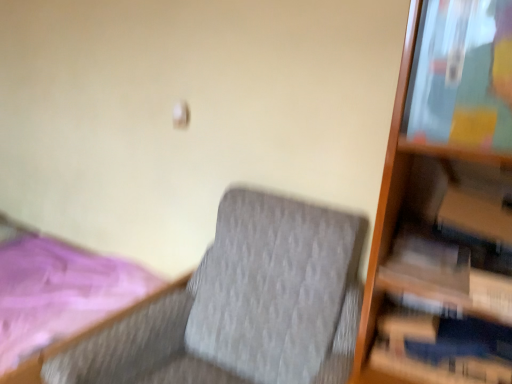
Where is `white matte paperback book at right`? Image resolution: width=512 pixels, height=384 pixels. white matte paperback book at right is located at coordinates (426, 267).

Locate an element on the screen. pink fabric bed at lower left is located at coordinates (52, 353).

Which is more distant, [119,342] or [414,262]?

The point [119,342] is farther.

Looking at this image, considering the sizes of objects textured gray fabric rocking chair at center and white matte paperback book at right in the image provided, who is thinner, textured gray fabric rocking chair at center or white matte paperback book at right?

white matte paperback book at right is thinner.

Is textured gray fabric rocking chair at center completely or partially outside of white matte paperback book at right?

Yes.

Is textured gray fabric rocking chair at center looking in the opposite direction of pink fabric bed at lower left?

No, textured gray fabric rocking chair at center is not facing away from pink fabric bed at lower left.

I want to click on rocking chair located in front of the pink fabric bed at lower left, so click(x=243, y=306).

How different are the orientations of textured gray fabric rocking chair at center and pink fabric bed at lower left in degrees?

89.9 degrees.

Is textured gray fabric rocking chair at center at the left side of pink fabric bed at lower left?

Incorrect, textured gray fabric rocking chair at center is not on the left side of pink fabric bed at lower left.

Is there a large distance between white matte paperback book at right and pink fabric bed at lower left?

Yes, white matte paperback book at right and pink fabric bed at lower left are located far from each other.

Is the position of white matte paperback book at right more distant than that of pink fabric bed at lower left?

No, it is not.

From the image's perspective, who appears lower, white matte paperback book at right or pink fabric bed at lower left?

pink fabric bed at lower left appears lower in the image.

How different are the orientations of white matte paperback book at right and pink fabric bed at lower left in degrees?

white matte paperback book at right and pink fabric bed at lower left are facing 82.9 degrees away from each other.

Are pink fabric bed at lower left and textured gray fabric rocking chair at center located far from each other?

Yes, pink fabric bed at lower left is far from textured gray fabric rocking chair at center.

Is textured gray fabric rocking chair at center surrounded by pink fabric bed at lower left?

No.

Is point (4, 234) positioned before point (317, 337)?

No, (4, 234) is further to viewer.

Is pink fabric bed at lower left facing towards textured gray fabric rocking chair at center?

Yes.

Is pink fabric bed at lower left further to the viewer compared to white matte paperback book at right?

Yes.

Is white matte paperback book at right located within pink fabric bed at lower left?

Actually, white matte paperback book at right is outside pink fabric bed at lower left.

Which object is wider, pink fabric bed at lower left or white matte paperback book at right?

pink fabric bed at lower left is wider.

How distant is pink fabric bed at lower left from white matte paperback book at right?

pink fabric bed at lower left is 1.66 meters away from white matte paperback book at right.

Consider the image. Considering the sizes of objects white matte paperback book at right and textured gray fabric rocking chair at center in the image provided, who is smaller, white matte paperback book at right or textured gray fabric rocking chair at center?

white matte paperback book at right is smaller.

Considering the points (442, 287) and (327, 337), which point is in front, point (442, 287) or point (327, 337)?

The point (442, 287) is more forward.

At what (x,y) coordinates should I click in order to perform the action: click on rocking chair in front of the white matte paperback book at right. Please return your answer as a coordinate pair (x, y). The height and width of the screenshot is (384, 512). Looking at the image, I should click on (243, 306).

Identify the location of rocking chair that is under the white matte paperback book at right (from a real-world perspective). This screenshot has width=512, height=384. (243, 306).

Find the location of a particular element. This screenshot has width=512, height=384. bed lying above the textured gray fabric rocking chair at center (from the image's perspective) is located at coordinates (52, 353).

When comparing their distances from white matte paperback book at right, does pink fabric bed at lower left or textured gray fabric rocking chair at center seem closer?

The object closer to white matte paperback book at right is textured gray fabric rocking chair at center.

Based on their spatial positions, is textured gray fabric rocking chair at center or pink fabric bed at lower left closer to white matte paperback book at right?

Among the two, textured gray fabric rocking chair at center is located nearer to white matte paperback book at right.

When comparing their distances from pink fabric bed at lower left, does white matte paperback book at right or textured gray fabric rocking chair at center seem further?

The object further to pink fabric bed at lower left is white matte paperback book at right.

From the image, which object appears to be nearer to textured gray fabric rocking chair at center, pink fabric bed at lower left or white matte paperback book at right?

white matte paperback book at right lies closer to textured gray fabric rocking chair at center than the other object.

When comparing their distances from pink fabric bed at lower left, does textured gray fabric rocking chair at center or white matte paperback book at right seem further?

white matte paperback book at right.

When comparing their distances from textured gray fabric rocking chair at center, does white matte paperback book at right or pink fabric bed at lower left seem further?

pink fabric bed at lower left is further to textured gray fabric rocking chair at center.

In order to click on rocking chair between pink fabric bed at lower left and white matte paperback book at right in this screenshot , I will do `click(243, 306)`.